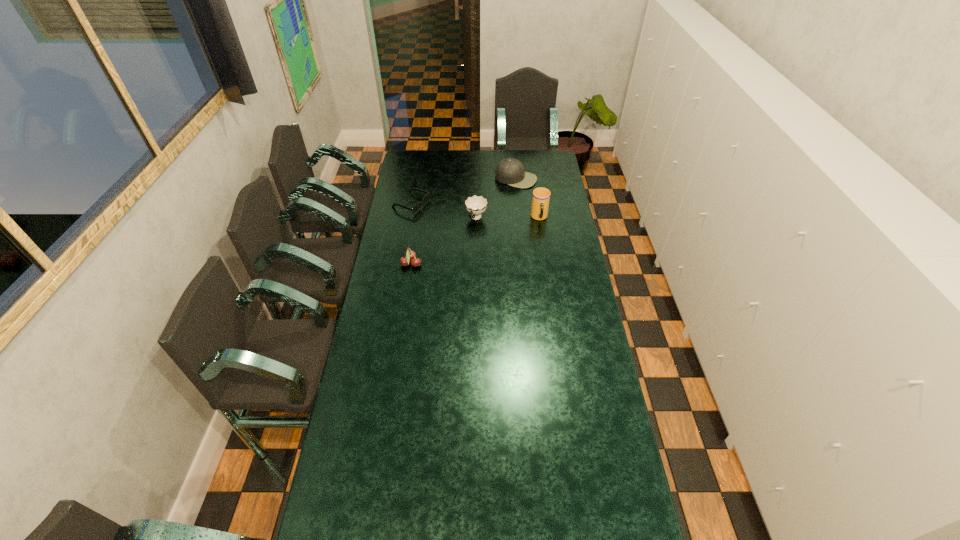
In order to click on vacant space on the desktop that is between the nearest object and the tallest object and is positioned on the brim of the farthest object in this screenshot , I will do `click(472, 242)`.

Find the location of a particular element. free space on the desktop that is between the nearest object and the taller cup and is positioned on the side of the left cup with the handle is located at coordinates (460, 247).

Where is `vacant space on the desktop that is between the cherry and the right cup and is positioned on the front-facing side of the sunglasses`? The image size is (960, 540). vacant space on the desktop that is between the cherry and the right cup and is positioned on the front-facing side of the sunglasses is located at coordinates (492, 235).